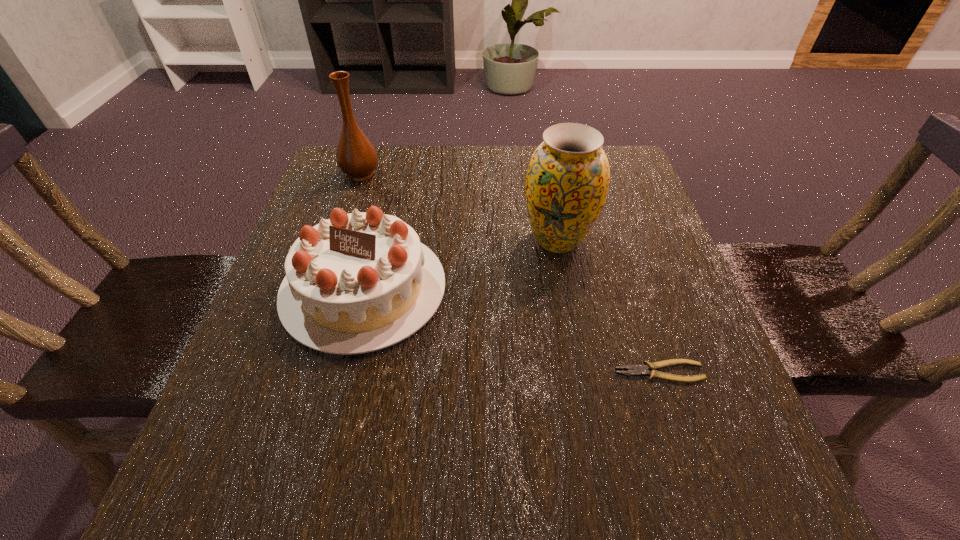
Locate which object is the closest to the farthest object. Please provide its 2D coordinates. Your answer should be formatted as a tuple, i.e. [(x, y)], where the tuple contains the x and y coordinates of a point satisfying the conditions above.

[(360, 282)]

Identify which object is the third nearest to the right vase. Please provide its 2D coordinates. Your answer should be formatted as a tuple, i.e. [(x, y)], where the tuple contains the x and y coordinates of a point satisfying the conditions above.

[(356, 157)]